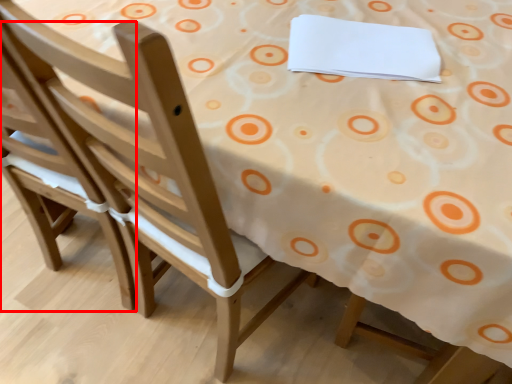
Question: From the image's perspective, what is the correct spatial relationship of chair (annotated by the red box) in relation to notepad?

Choices:
 (A) below
 (B) above

Answer: (A)